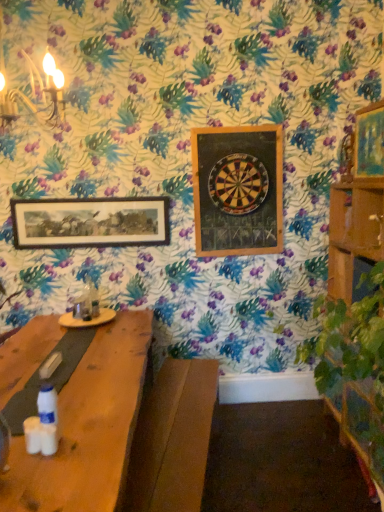
Where is `wooden dartboard at upper center, which is counted as the 2th picture frame, starting from the left`? The image size is (384, 512). wooden dartboard at upper center, which is counted as the 2th picture frame, starting from the left is located at coordinates (237, 190).

What is the approximate height of matte gold picture frame at upper right, acting as the first picture frame starting from the right?

The height of matte gold picture frame at upper right, acting as the first picture frame starting from the right, is 16.54 inches.

At what (x,y) coordinates should I click in order to perform the action: click on wooden dartboard at center. Please return your answer as a coordinate pair (x, y). The image size is (384, 512). Looking at the image, I should click on (238, 184).

What do you see at coordinates (238, 184) in the screenshot?
I see `wooden dartboard at center` at bounding box center [238, 184].

Image resolution: width=384 pixels, height=512 pixels. In order to click on wooden framed artwork at upper left, the 1th picture frame viewed from the left in this screenshot , I will do `click(90, 222)`.

In order to click on wooden dartboard at upper center, arranged as the 2th picture frame when viewed from the right in this screenshot , I will do `click(237, 190)`.

Does wooden dartboard at upper center, which is counted as the 2th picture frame, starting from the left, have a greater width compared to wooden dartboard at center?

Incorrect, the width of wooden dartboard at upper center, which is counted as the 2th picture frame, starting from the left, does not surpass that of wooden dartboard at center.

Considering the sizes of wooden dartboard at upper center, arranged as the 2th picture frame when viewed from the right, and wooden dartboard at center in the image, is wooden dartboard at upper center, arranged as the 2th picture frame when viewed from the right, taller or shorter than wooden dartboard at center?

Considering their sizes, wooden dartboard at upper center, arranged as the 2th picture frame when viewed from the right, has more height than wooden dartboard at center.

Is wooden dartboard at upper center, which is the second picture frame from back to front, positioned with its back to wooden dartboard at center?

Yes, wooden dartboard at center is at the back of wooden dartboard at upper center, which is the second picture frame from back to front.

How distant is wooden dartboard at upper center, which is the second picture frame from back to front, from wooden dartboard at center?

The distance of wooden dartboard at upper center, which is the second picture frame from back to front, from wooden dartboard at center is 2.82 inches.

From a real-world perspective, is wooden dartboard at upper center, which is counted as the 2th picture frame, starting from the left, located beneath matte gold picture frame at upper right, the third picture frame when ordered from left to right?

Correct, in the physical world, wooden dartboard at upper center, which is counted as the 2th picture frame, starting from the left, is lower than matte gold picture frame at upper right, the third picture frame when ordered from left to right.

From the image's perspective, is wooden dartboard at upper center, which is the 2th picture frame in front-to-back order, above or below matte gold picture frame at upper right, marked as the 3th picture frame in a back-to-front arrangement?

wooden dartboard at upper center, which is the 2th picture frame in front-to-back order, is situated lower than matte gold picture frame at upper right, marked as the 3th picture frame in a back-to-front arrangement, in the image.

I want to click on picture frame above the wooden dartboard at upper center, which is the 2th picture frame in front-to-back order (from a real-world perspective), so click(369, 141).

Which is more to the left, wooden dartboard at upper center, which is counted as the 2th picture frame, starting from the left, or matte gold picture frame at upper right, placed as the first picture frame when sorted from front to back?

wooden dartboard at upper center, which is counted as the 2th picture frame, starting from the left, is more to the left.

Considering the sizes of objects wooden dartboard at upper center, which is the 2th picture frame in front-to-back order, and wooden framed artwork at upper left, the 1th picture frame viewed from the left, in the image provided, who is wider, wooden dartboard at upper center, which is the 2th picture frame in front-to-back order, or wooden framed artwork at upper left, the 1th picture frame viewed from the left,?

Wider between the two is wooden dartboard at upper center, which is the 2th picture frame in front-to-back order.

Would you consider wooden dartboard at upper center, which is the 2th picture frame in front-to-back order, to be distant from wooden framed artwork at upper left, the 1th picture frame viewed from the left?

wooden dartboard at upper center, which is the 2th picture frame in front-to-back order, is actually quite close to wooden framed artwork at upper left, the 1th picture frame viewed from the left.

Could you tell me if wooden dartboard at upper center, which is counted as the 2th picture frame, starting from the left, is turned towards wooden framed artwork at upper left, acting as the 1th picture frame starting from the back?

No.

Is wooden dartboard at upper center, which is the second picture frame from back to front, inside the boundaries of wooden framed artwork at upper left, acting as the 1th picture frame starting from the back, or outside?

wooden dartboard at upper center, which is the second picture frame from back to front, exists outside the volume of wooden framed artwork at upper left, acting as the 1th picture frame starting from the back.

Is matte gold picture frame at upper right, placed as the first picture frame when sorted from front to back, turned away from wooden dartboard at center?

No, matte gold picture frame at upper right, placed as the first picture frame when sorted from front to back,'s orientation is not away from wooden dartboard at center.

Which object is positioned more to the left, matte gold picture frame at upper right, acting as the first picture frame starting from the right, or wooden dartboard at center?

Positioned to the left is wooden dartboard at center.

Is matte gold picture frame at upper right, placed as the first picture frame when sorted from front to back, shorter than wooden dartboard at center?

Yes.

From the image's perspective, is matte gold picture frame at upper right, placed as the first picture frame when sorted from front to back, below wooden dartboard at center?

Actually, matte gold picture frame at upper right, placed as the first picture frame when sorted from front to back, appears above wooden dartboard at center in the image.

Is wooden framed artwork at upper left, the 1th picture frame viewed from the left, positioned beyond the bounds of wooden dartboard at center?

wooden framed artwork at upper left, the 1th picture frame viewed from the left, lies outside wooden dartboard at center's area.

From the image's perspective, between wooden framed artwork at upper left, which appears as the 3th picture frame when viewed from the front, and wooden dartboard at center, which one is located above?

wooden dartboard at center, from the image's perspective.

In the scene shown: Which is closer, (96,241) or (238,183)?

The point (238,183) is in front.

Is wooden framed artwork at upper left, the 1th picture frame viewed from the left, facing towards matte gold picture frame at upper right, marked as the 3th picture frame in a back-to-front arrangement?

No, wooden framed artwork at upper left, the 1th picture frame viewed from the left, is not oriented towards matte gold picture frame at upper right, marked as the 3th picture frame in a back-to-front arrangement.

Which is correct: wooden framed artwork at upper left, which appears as the 3th picture frame when viewed from the front, is inside matte gold picture frame at upper right, placed as the first picture frame when sorted from front to back, or outside of it?

wooden framed artwork at upper left, which appears as the 3th picture frame when viewed from the front, is outside matte gold picture frame at upper right, placed as the first picture frame when sorted from front to back.

Are wooden framed artwork at upper left, acting as the 1th picture frame starting from the back, and matte gold picture frame at upper right, the third picture frame when ordered from left to right, located far from each other?

wooden framed artwork at upper left, acting as the 1th picture frame starting from the back, is far away from matte gold picture frame at upper right, the third picture frame when ordered from left to right.

Considering the sizes of objects matte gold picture frame at upper right, marked as the 3th picture frame in a back-to-front arrangement, and wooden dartboard at upper center, arranged as the 2th picture frame when viewed from the right, in the image provided, who is shorter, matte gold picture frame at upper right, marked as the 3th picture frame in a back-to-front arrangement, or wooden dartboard at upper center, arranged as the 2th picture frame when viewed from the right,?

With less height is matte gold picture frame at upper right, marked as the 3th picture frame in a back-to-front arrangement.

Is point (359, 149) positioned behind point (218, 197)?

That is False.

From a real-world perspective, is matte gold picture frame at upper right, acting as the first picture frame starting from the right, physically located above or below wooden dartboard at upper center, which is the 2th picture frame in front-to-back order?

matte gold picture frame at upper right, acting as the first picture frame starting from the right, is situated higher than wooden dartboard at upper center, which is the 2th picture frame in front-to-back order, in the real world.

Is matte gold picture frame at upper right, acting as the first picture frame starting from the right, next to wooden dartboard at upper center, which is counted as the 2th picture frame, starting from the left, and touching it?

No, matte gold picture frame at upper right, acting as the first picture frame starting from the right, is not making contact with wooden dartboard at upper center, which is counted as the 2th picture frame, starting from the left.

Locate an element on the screen. design lying in front of the wooden dartboard at upper center, which is the 2th picture frame in front-to-back order is located at coordinates (238, 184).

This screenshot has width=384, height=512. In order to click on picture frame to the right of wooden dartboard at upper center, arranged as the 2th picture frame when viewed from the right in this screenshot , I will do `click(369, 141)`.

Based on the photo, based on their spatial positions, is wooden dartboard at upper center, which is the second picture frame from back to front, or wooden framed artwork at upper left, the 3th picture frame viewed from the right, further from wooden dartboard at center?

The object further to wooden dartboard at center is wooden framed artwork at upper left, the 3th picture frame viewed from the right.

When comparing their distances from matte gold picture frame at upper right, placed as the first picture frame when sorted from front to back, does wooden framed artwork at upper left, acting as the 1th picture frame starting from the back, or wooden dartboard at upper center, which is the second picture frame from back to front, seem further?

Based on the image, wooden framed artwork at upper left, acting as the 1th picture frame starting from the back, appears to be further to matte gold picture frame at upper right, placed as the first picture frame when sorted from front to back.

From the image, which object appears to be nearer to wooden dartboard at center, wooden framed artwork at upper left, the 1th picture frame viewed from the left, or matte gold picture frame at upper right, placed as the first picture frame when sorted from front to back?

The object closer to wooden dartboard at center is wooden framed artwork at upper left, the 1th picture frame viewed from the left.

In the scene shown: Estimate the real-world distances between objects in this image. Which object is closer to wooden dartboard at upper center, which is counted as the 2th picture frame, starting from the left, matte gold picture frame at upper right, marked as the 3th picture frame in a back-to-front arrangement, or wooden dartboard at center?

wooden dartboard at center is positioned closer to the anchor wooden dartboard at upper center, which is counted as the 2th picture frame, starting from the left.

In the scene shown: Estimate the real-world distances between objects in this image. Which object is further from matte gold picture frame at upper right, marked as the 3th picture frame in a back-to-front arrangement, wooden dartboard at center or wooden dartboard at upper center, arranged as the 2th picture frame when viewed from the right?

wooden dartboard at upper center, arranged as the 2th picture frame when viewed from the right, lies further to matte gold picture frame at upper right, marked as the 3th picture frame in a back-to-front arrangement, than the other object.

Looking at the image, which one is located closer to wooden dartboard at upper center, arranged as the 2th picture frame when viewed from the right, wooden framed artwork at upper left, the 1th picture frame viewed from the left, or wooden dartboard at center?

wooden dartboard at center.

Considering their positions, is wooden dartboard at center positioned further to wooden dartboard at upper center, which is the second picture frame from back to front, than wooden framed artwork at upper left, the 3th picture frame viewed from the right?

wooden framed artwork at upper left, the 3th picture frame viewed from the right, lies further to wooden dartboard at upper center, which is the second picture frame from back to front, than the other object.

From the image, which object appears to be nearer to matte gold picture frame at upper right, placed as the first picture frame when sorted from front to back, wooden framed artwork at upper left, the 3th picture frame viewed from the right, or wooden dartboard at center?

Among the two, wooden dartboard at center is located nearer to matte gold picture frame at upper right, placed as the first picture frame when sorted from front to back.

Identify the location of design located between wooden framed artwork at upper left, the 1th picture frame viewed from the left, and matte gold picture frame at upper right, marked as the 3th picture frame in a back-to-front arrangement, in the left-right direction. (238, 184).

Where is `design between wooden framed artwork at upper left, which appears as the 3th picture frame when viewed from the front, and wooden dartboard at upper center, which is the 2th picture frame in front-to-back order`? The height and width of the screenshot is (512, 384). design between wooden framed artwork at upper left, which appears as the 3th picture frame when viewed from the front, and wooden dartboard at upper center, which is the 2th picture frame in front-to-back order is located at coordinates (238, 184).

The height and width of the screenshot is (512, 384). In order to click on picture frame between wooden framed artwork at upper left, the 3th picture frame viewed from the right, and matte gold picture frame at upper right, marked as the 3th picture frame in a back-to-front arrangement, in the horizontal direction in this screenshot , I will do `click(237, 190)`.

Locate an element on the screen. The height and width of the screenshot is (512, 384). design located between matte gold picture frame at upper right, marked as the 3th picture frame in a back-to-front arrangement, and wooden dartboard at upper center, which is the 2th picture frame in front-to-back order, in the depth direction is located at coordinates (238, 184).